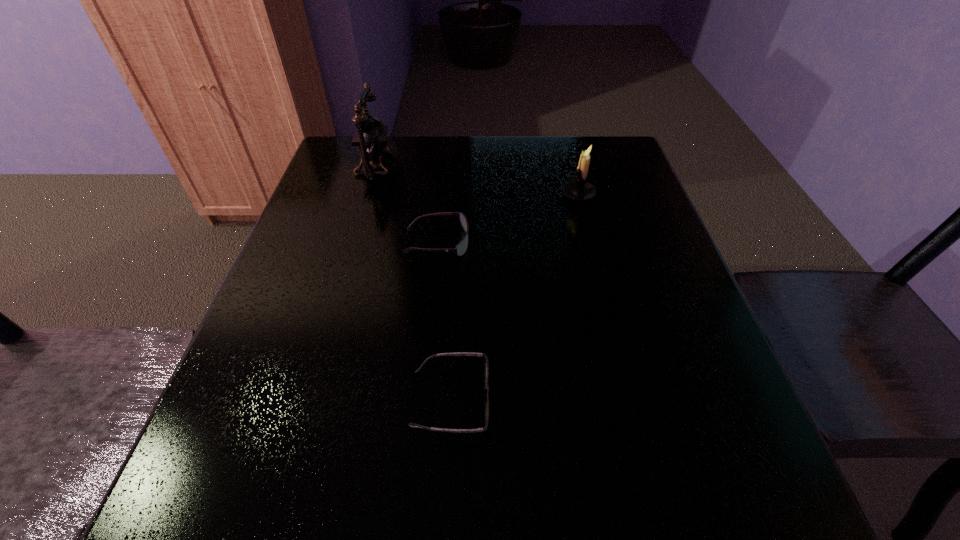
Where is `vacant space situated 0.370m on the lenses of the taller sunglasses`? vacant space situated 0.370m on the lenses of the taller sunglasses is located at coordinates (640, 242).

The image size is (960, 540). In order to click on vacant space situated 0.310m on the front-facing side of the shortest object in this screenshot , I will do `click(685, 399)`.

At what (x,y) coordinates should I click in order to perform the action: click on object positioned at the far edge. Please return your answer as a coordinate pair (x, y). The image size is (960, 540). Looking at the image, I should click on (370, 139).

Locate an element on the screen. object that is at the left edge is located at coordinates (370, 139).

Where is `object that is positioned at the right edge`? This screenshot has height=540, width=960. object that is positioned at the right edge is located at coordinates (579, 189).

Locate an element on the screen. This screenshot has width=960, height=540. object that is at the far left corner is located at coordinates (370, 139).

Identify the location of blank space at the far edge of the desktop. The height and width of the screenshot is (540, 960). (548, 147).

Where is `free point at the near edge`? This screenshot has height=540, width=960. free point at the near edge is located at coordinates (336, 502).

The height and width of the screenshot is (540, 960). What are the coordinates of `vacant space at the left edge of the desktop` in the screenshot? It's located at (332, 243).

Locate an element on the screen. This screenshot has width=960, height=540. vacant space at the right edge of the desktop is located at coordinates (645, 364).